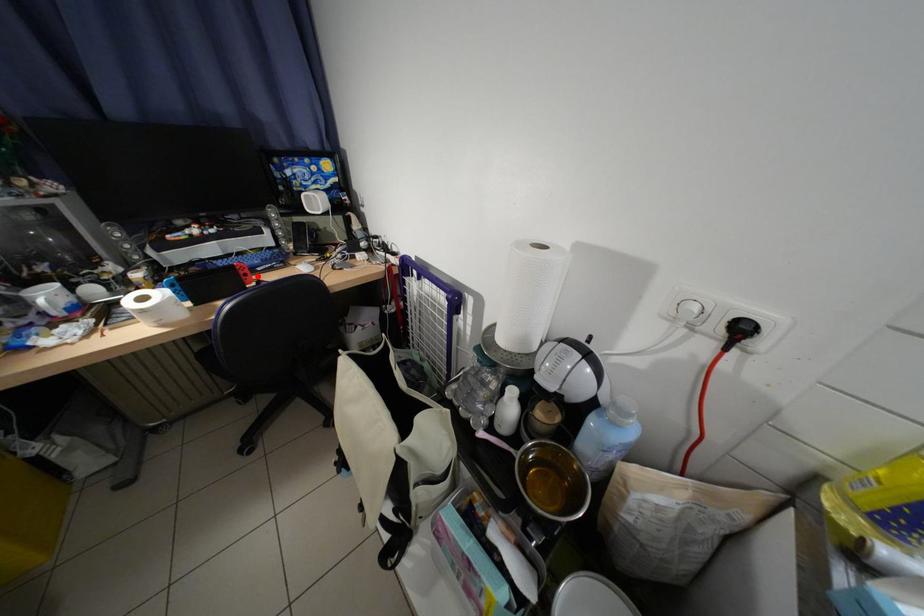
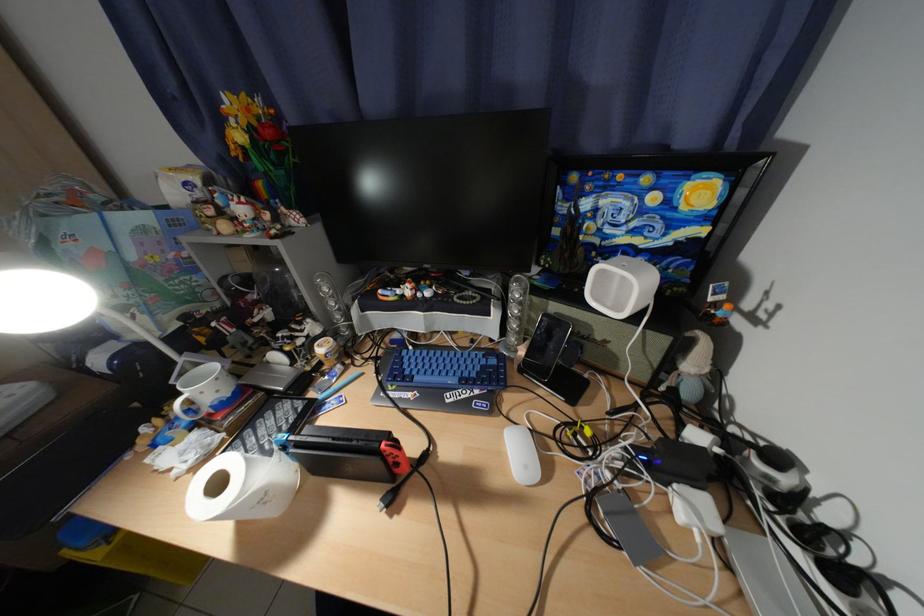
Locate, in the second image, the point that corresponds to the highlighted location in the first image.

(408, 466)